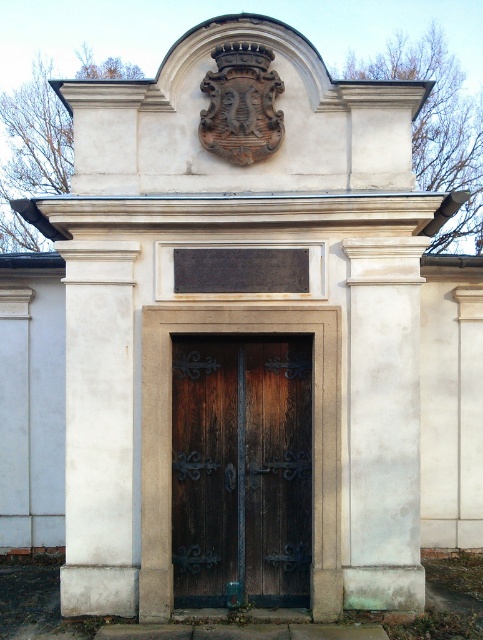
You are standing in front of the building and looking at the wooden double doors. There are two points marked on the doors. One is at coordinate point (268, 449) and the other at point (124, 250). Which point is closer to you?

Point (268, 449) is further to the viewer than point (124, 250), so the point closer to you is point (124, 250).

You are standing in front of the building and want to touch both points on the structure. Which point should you reach for first, the point at coordinate (x=255, y=397) or the point at coordinate (x=358, y=280)?

You should reach for the point at coordinate (x=255, y=397) first because it is closer to you than the point at coordinate (x=358, y=280).